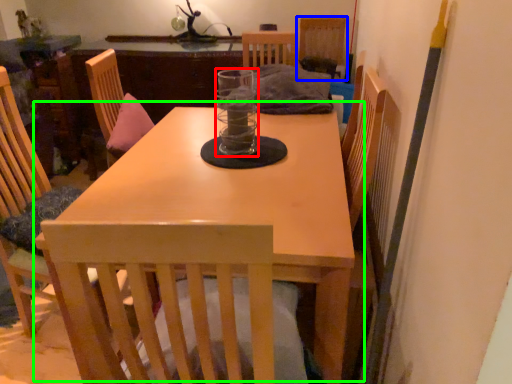
Question: Which object is positioned farthest from glass jar (highlighted by a red box)? Select from chair (highlighted by a blue box) and table (highlighted by a green box).

Choices:
 (A) chair
 (B) table

Answer: (A)